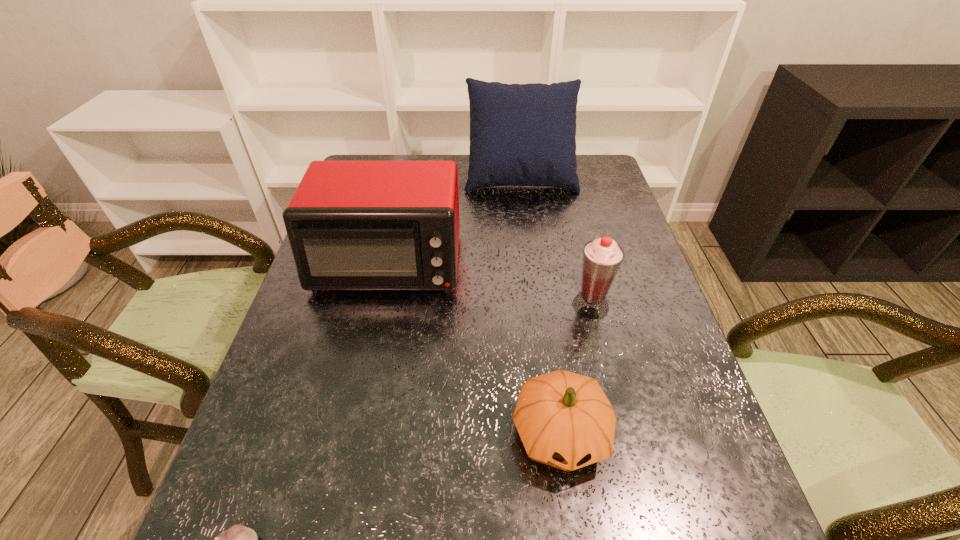
This screenshot has width=960, height=540. I want to click on cushion, so click(520, 134).

Where is `the tallest object`? This screenshot has height=540, width=960. the tallest object is located at coordinates (520, 134).

This screenshot has height=540, width=960. I want to click on toaster oven, so point(352,225).

Locate an element on the screen. smoothie is located at coordinates (602, 257).

What are the coordinates of `the fourth tallest object` in the screenshot? It's located at (564, 419).

Find the location of `the second nearest object`. the second nearest object is located at coordinates 564,419.

Where is `free space located on the facing side of the cushion`? This screenshot has height=540, width=960. free space located on the facing side of the cushion is located at coordinates (534, 281).

Identify the location of vacant space situated on the front-facing side of the toaster oven. This screenshot has width=960, height=540. (375, 319).

I want to click on vacant space located 0.380m on the front of the smoothie, so click(x=636, y=489).

Where is `object present at the far edge`? object present at the far edge is located at coordinates (520, 134).